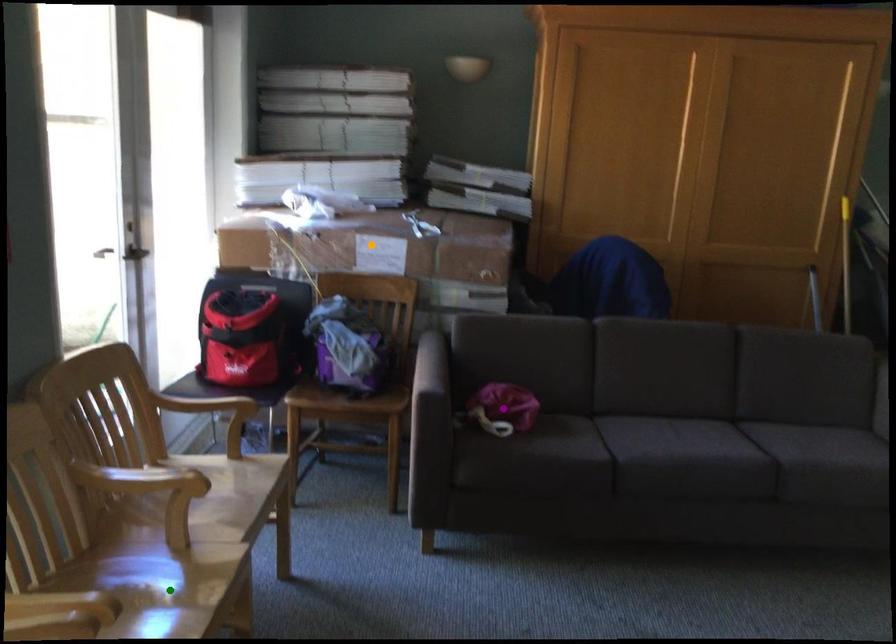
Order these from nearest to farthest:
- purple point
- orange point
- green point

green point < purple point < orange point